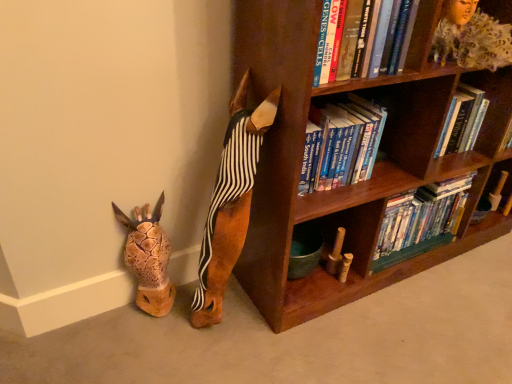
Identify the location of free space in front of brown wooden dog at center, which appears as the 2th animal when viewed from the left. (217, 352).